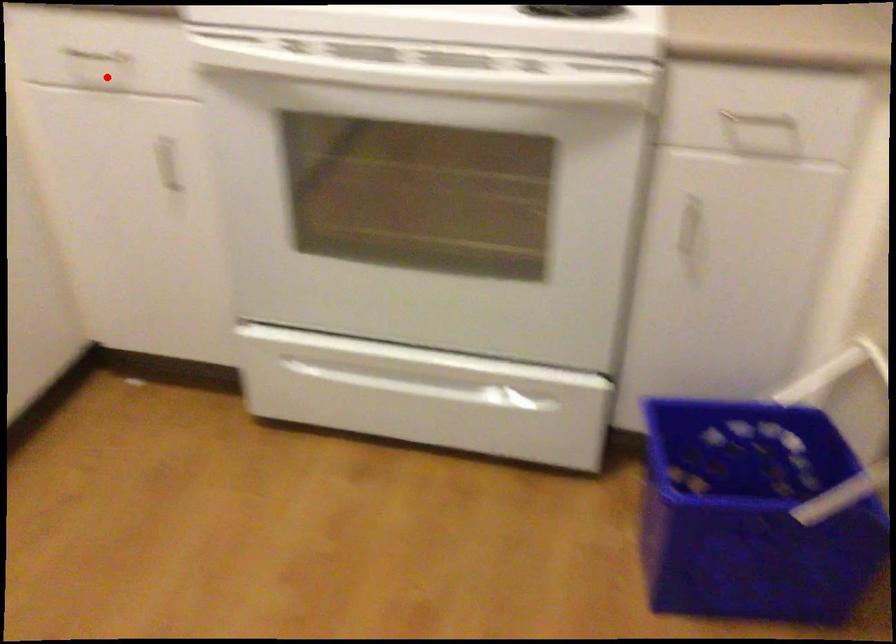
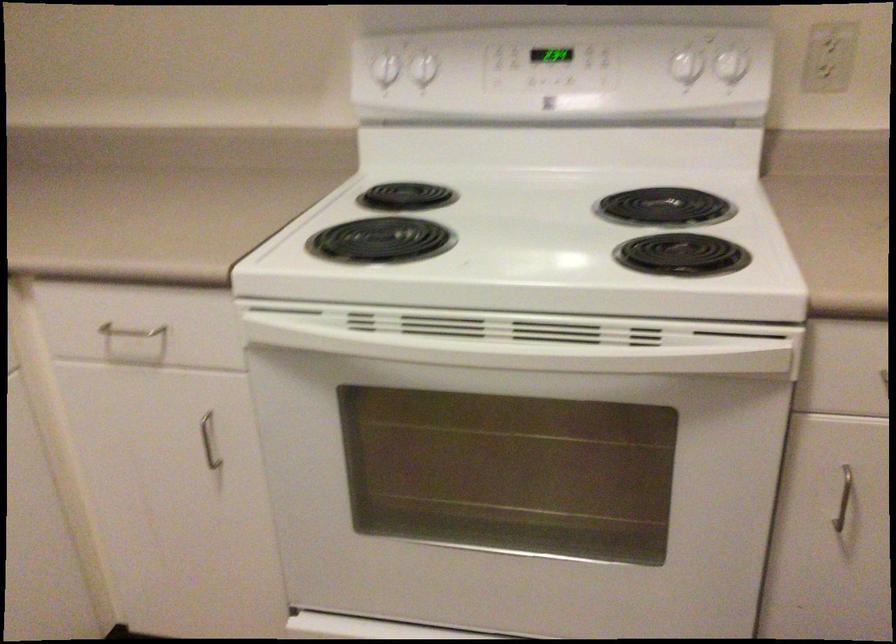
Question: I am providing you with two images of the same scene from different viewpoints. A red point is marked on the first image. At the location where the point appears in image 1, is it still visible in image 2?

Choices:
 (A) Yes
 (B) No

Answer: (A)